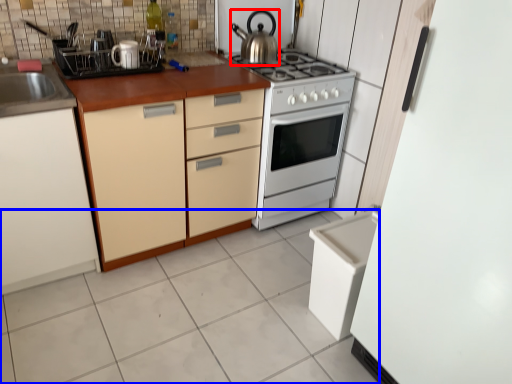
Question: Which point is further to the camera, kitchen appliance (highlighted by a red box) or ceramic tile (highlighted by a blue box)?

Choices:
 (A) kitchen appliance
 (B) ceramic tile

Answer: (A)